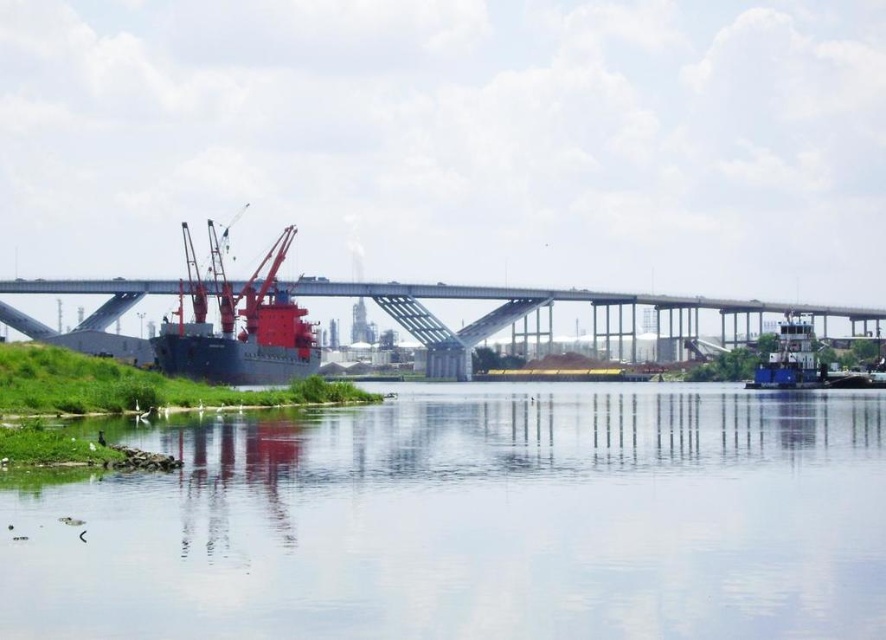
Can you confirm if clear water at center is bigger than metallic blue cargo ship at center?

No.

Between point (736, 540) and point (296, 360), which one is positioned behind?

The point (296, 360) is more distant.

Image resolution: width=886 pixels, height=640 pixels. I want to click on clear water at center, so click(473, 522).

Is the position of clear water at center less distant than that of metallic gray bridge at center?

Yes, clear water at center is closer to the viewer.

Who is more forward, (362, 624) or (455, 372)?

Point (362, 624)

What do you see at coordinates (473, 522) in the screenshot? I see `clear water at center` at bounding box center [473, 522].

The image size is (886, 640). Find the location of `clear water at center`. clear water at center is located at coordinates (473, 522).

Does metallic gray bridge at center appear on the left side of metallic blue cargo ship at center?

No, metallic gray bridge at center is not to the left of metallic blue cargo ship at center.

At what (x,y) coordinates should I click in order to perform the action: click on metallic gray bridge at center. Please return your answer as a coordinate pair (x, y). Looking at the image, I should click on (545, 305).

Is point (37, 291) less distant than point (274, 337)?

No, (37, 291) is behind (274, 337).

Find the location of a particular element. This screenshot has height=640, width=886. metallic gray bridge at center is located at coordinates (545, 305).